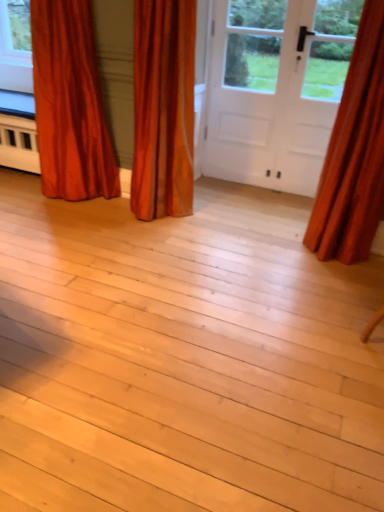
Find the location of a particular element. The image size is (384, 512). vacant space in front of velvet orange curtain at left, which appears as the third curtain when viewed from the right is located at coordinates (63, 223).